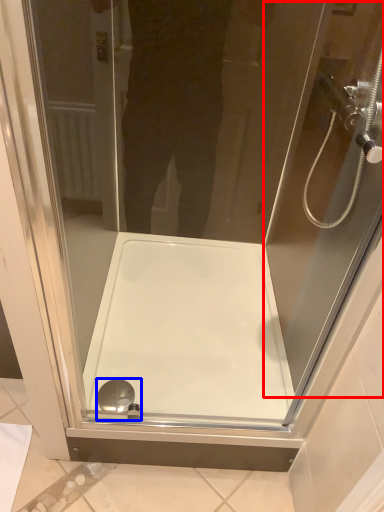
Question: Which object appears farthest to the camera in this image, screen door (highlighted by a red box) or shower (highlighted by a blue box)?

Choices:
 (A) screen door
 (B) shower

Answer: (B)